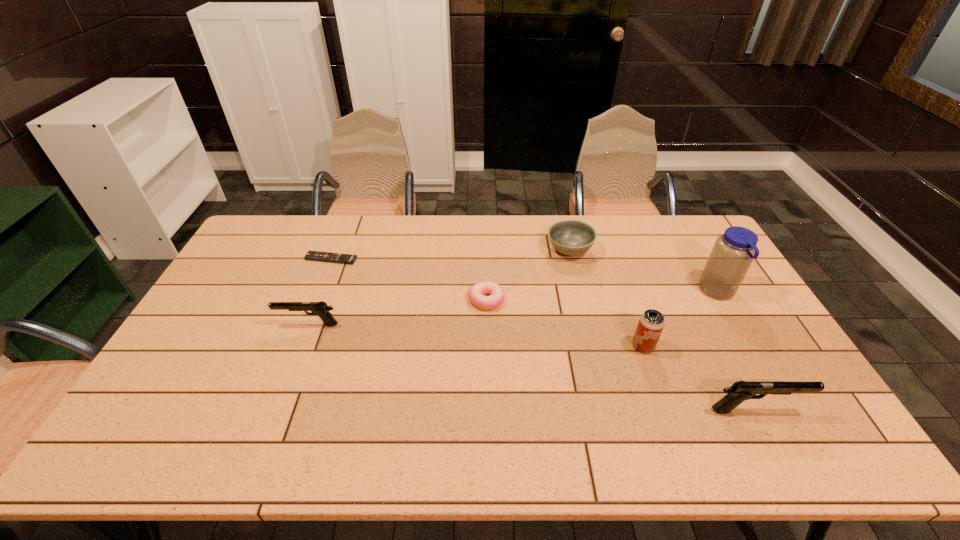
Identify the location of the farther gun. [x=320, y=309].

This screenshot has width=960, height=540. I want to click on the shorter gun, so click(x=320, y=309).

Image resolution: width=960 pixels, height=540 pixels. In order to click on the right gun in this screenshot , I will do `click(740, 391)`.

Image resolution: width=960 pixels, height=540 pixels. In order to click on the taller gun in this screenshot , I will do `click(740, 391)`.

Where is `bowl`? This screenshot has height=540, width=960. bowl is located at coordinates (571, 238).

Locate an element on the screen. The height and width of the screenshot is (540, 960). the fourth object from left to right is located at coordinates (571, 238).

Identify the location of water bottle. (733, 252).

Find the location of a particular element. The image size is (960, 540). the shortest object is located at coordinates (311, 255).

Where is `the fifth object from right to left`? The height and width of the screenshot is (540, 960). the fifth object from right to left is located at coordinates (476, 293).

At what (x,y) coordinates should I click in order to perform the action: click on the sixth tallest object. Please return your answer as a coordinate pair (x, y). Looking at the image, I should click on (476, 293).